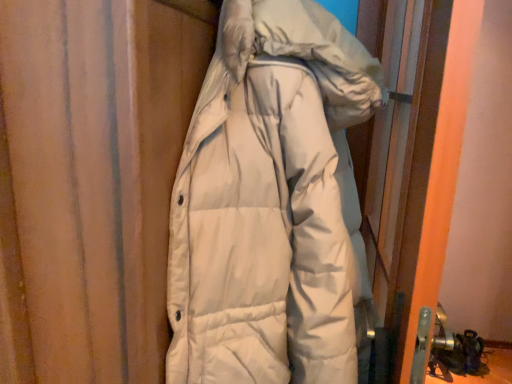
Question: Is white matte screen door at right spatially inside white down jacket at center, or outside of it?

Choices:
 (A) outside
 (B) inside

Answer: (A)

Question: From a real-world perspective, is white matte screen door at right positioned above or below white down jacket at center?

Choices:
 (A) below
 (B) above

Answer: (A)

Question: Looking at the image, does white matte screen door at right seem bigger or smaller compared to white down jacket at center?

Choices:
 (A) big
 (B) small

Answer: (B)

Question: Is white down jacket at center in front of or behind white matte screen door at right in the image?

Choices:
 (A) behind
 (B) front

Answer: (B)

Question: In terms of width, does white down jacket at center look wider or thinner when compared to white matte screen door at right?

Choices:
 (A) wide
 (B) thin

Answer: (A)

Question: Considering the positions of point (309, 72) and point (393, 185), is point (309, 72) closer or farther from the camera than point (393, 185)?

Choices:
 (A) farther
 (B) closer

Answer: (B)

Question: In terms of size, does white down jacket at center appear bigger or smaller than white matte screen door at right?

Choices:
 (A) small
 (B) big

Answer: (B)